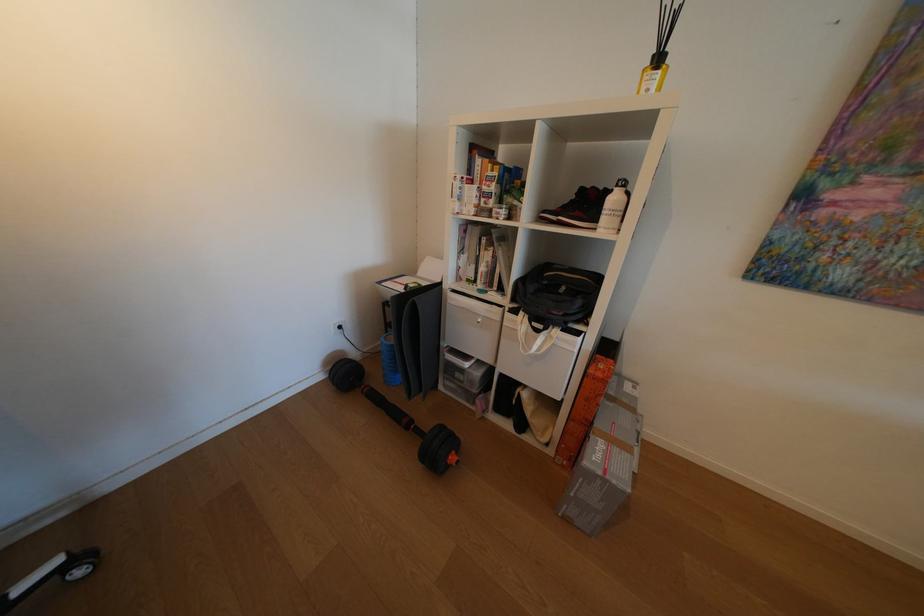
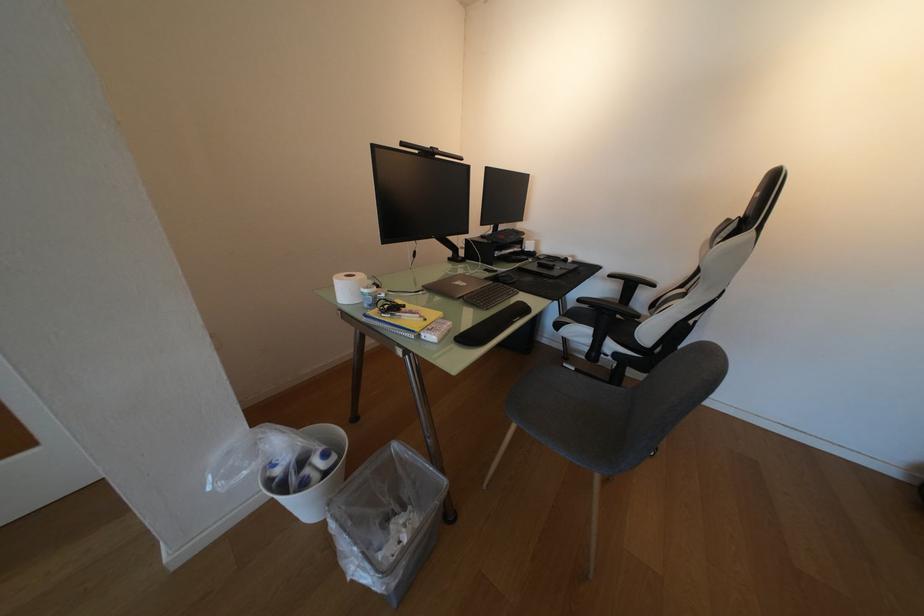
The first image is from the beginning of the video and the second image is from the end. How did the camera likely rotate when shooting the video?

The camera's rotation is toward left-down.